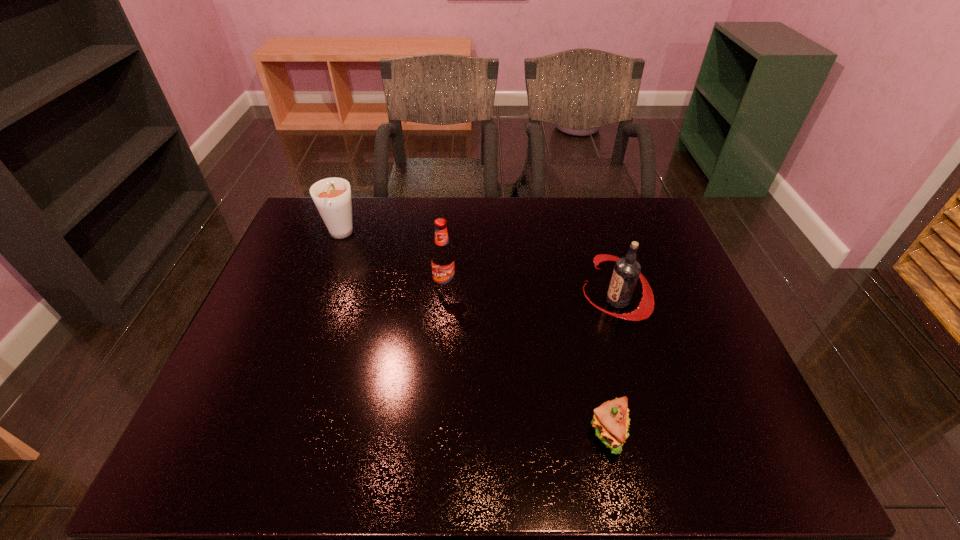
Where is `blank space located on the label of the rightmost root beer`? blank space located on the label of the rightmost root beer is located at coordinates (566, 301).

This screenshot has height=540, width=960. In order to click on free space located 0.270m on the left of the shortest object in this screenshot , I will do `click(463, 432)`.

Locate an element on the screen. The width and height of the screenshot is (960, 540). object that is at the far edge is located at coordinates (332, 196).

Find the location of a particular element. object located at the near edge is located at coordinates (610, 420).

Locate an element on the screen. Image resolution: width=960 pixels, height=540 pixels. object located at the left edge is located at coordinates (332, 196).

The height and width of the screenshot is (540, 960). I want to click on object that is positioned at the right edge, so click(x=626, y=272).

Identify the location of object located in the far left corner section of the desktop. (332, 196).

You are a GUI agent. You are given a task and a screenshot of the screen. Output one action in this format:
    pyautogui.click(x=<x>, y=<y>)
    Task: Click on the free spot at the far edge of the desktop
    The width and height of the screenshot is (960, 540).
    Given the screenshot: What is the action you would take?
    pyautogui.click(x=434, y=221)

Where is `vacant space at the near edge of the desktop`? Image resolution: width=960 pixels, height=540 pixels. vacant space at the near edge of the desktop is located at coordinates coord(390,441).

Identify the location of vacant space at the left edge of the desktop. (326, 244).